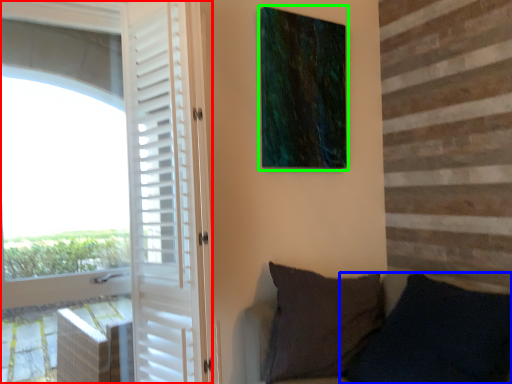
Question: Estimate the real-world distances between objects in this image. Which object is closer to door (highlighted by a red box), pillow (highlighted by a blue box) or picture frame (highlighted by a green box)?

Choices:
 (A) pillow
 (B) picture frame

Answer: (B)